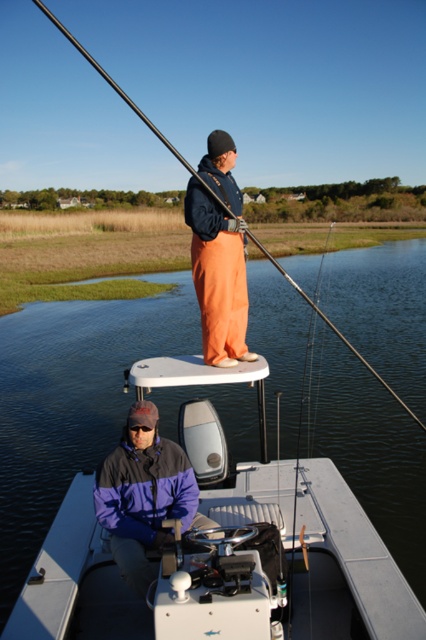
Question: Observing the image, what is the correct spatial positioning of purple fleece jacket at lower center in reference to orange cotton pants at center?

Choices:
 (A) below
 (B) above

Answer: (A)

Question: Is purple fleece jacket at lower center behind black rod at upper center?

Choices:
 (A) no
 (B) yes

Answer: (A)

Question: Does clear water at center have a larger size compared to black rod at upper center?

Choices:
 (A) yes
 (B) no

Answer: (B)

Question: Which point is farther to the camera?

Choices:
 (A) purple fleece jacket at lower center
 (B) clear water at center
 (C) black rod at upper center
 (D) orange cotton pants at center

Answer: (B)

Question: Based on their relative distances, which object is nearer to the black rod at upper center?

Choices:
 (A) clear water at center
 (B) purple fleece jacket at lower center
 (C) orange cotton pants at center

Answer: (B)

Question: Which point is closer to the camera?

Choices:
 (A) black rod at upper center
 (B) purple fleece jacket at lower center
 (C) orange cotton pants at center

Answer: (B)